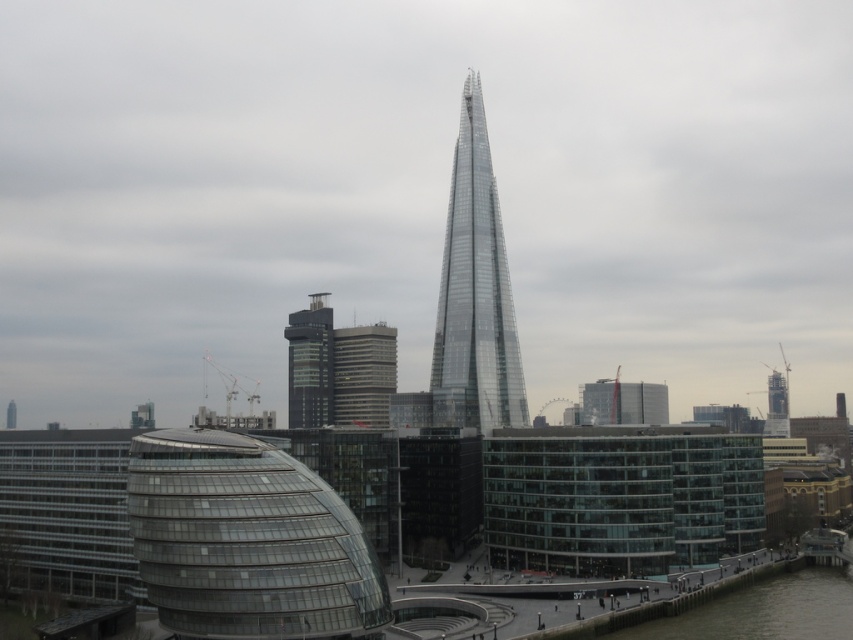
Who is taller, transparent glass tower at center or black glass tower at center?

transparent glass tower at center is taller.

Find the location of `transparent glass tower at center`. transparent glass tower at center is located at coordinates (474, 291).

How far apart are clear water at lower right and matte glass building at center?

clear water at lower right and matte glass building at center are 321.35 meters apart from each other.

Between clear water at lower right and matte glass building at center, which one has more height?

Standing taller between the two is matte glass building at center.

Is point (770, 588) less distant than point (364, 403)?

That is True.

Locate an element on the screen. clear water at lower right is located at coordinates (764, 611).

Is point (383, 384) positioned behind point (329, 360)?

No.

At what (x,y) coordinates should I click in order to perform the action: click on matte glass building at center. Please return your answer as a coordinate pair (x, y). This screenshot has width=853, height=640. Looking at the image, I should click on (363, 374).

Identify the location of matte glass building at center. (363, 374).